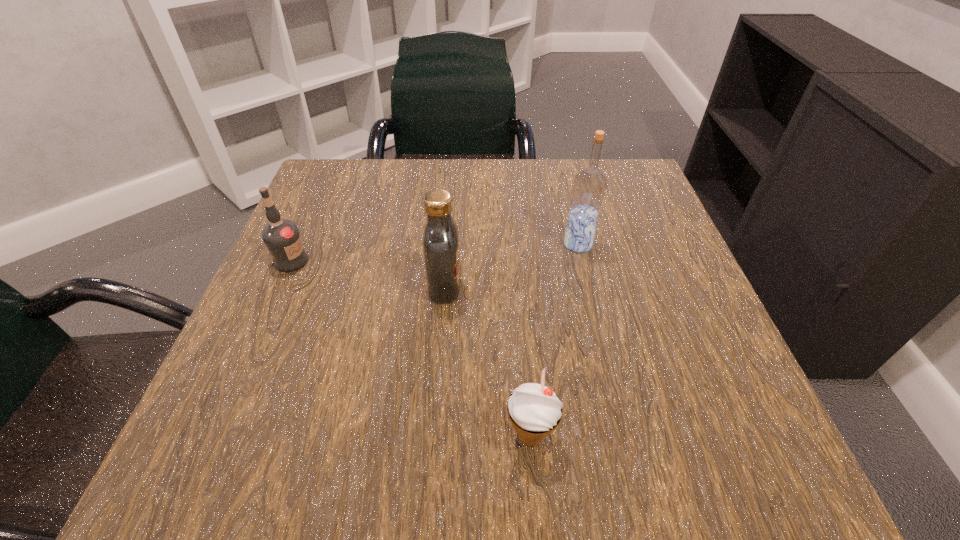
Image resolution: width=960 pixels, height=540 pixels. I want to click on vacant region at the near right corner of the desktop, so click(684, 458).

You are a GUI agent. You are given a task and a screenshot of the screen. Output one action in this format:
    pyautogui.click(x=<x>, y=<y>)
    Task: Click on the empty space between the second object from left to right and the leftmost object
    Image resolution: width=960 pixels, height=540 pixels.
    Given the screenshot: What is the action you would take?
    pyautogui.click(x=368, y=274)

The width and height of the screenshot is (960, 540). Find the location of `empty space between the second object from right to left and the leftmost object`. empty space between the second object from right to left and the leftmost object is located at coordinates (411, 348).

This screenshot has width=960, height=540. What are the coordinates of `free area in between the second tallest vodka and the leftmost vodka` in the screenshot? It's located at (368, 274).

Locate an element on the screen. This screenshot has width=960, height=540. vacant point located between the second shortest vodka and the tallest object is located at coordinates (512, 266).

The height and width of the screenshot is (540, 960). I want to click on empty location between the leftmost object and the shortest object, so click(411, 348).

Where is `free space between the shortest object and the tallest vodka`? free space between the shortest object and the tallest vodka is located at coordinates (554, 340).

Find the location of a particular element. Image resolution: width=960 pixels, height=540 pixels. empty space that is in between the tallest object and the second vodka from right to left is located at coordinates (512, 266).

Where is `vacant space in between the nearest object and the leftmost object`? The image size is (960, 540). vacant space in between the nearest object and the leftmost object is located at coordinates (411, 348).

At what (x,y) coordinates should I click in order to perform the action: click on vacant area that lies between the second vodka from left to right and the tallest object. Please return your answer as a coordinate pair (x, y). Looking at the image, I should click on pos(512,266).